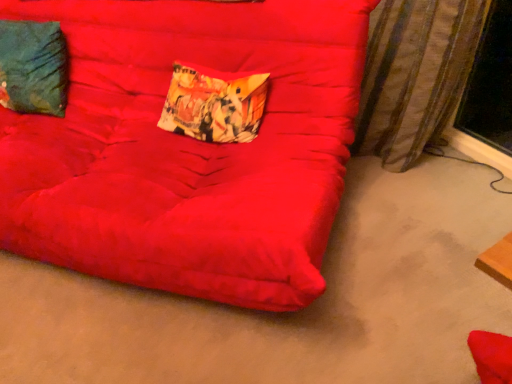
The image size is (512, 384). I want to click on vacant space in front of striped fabric curtain at right, so click(x=410, y=197).